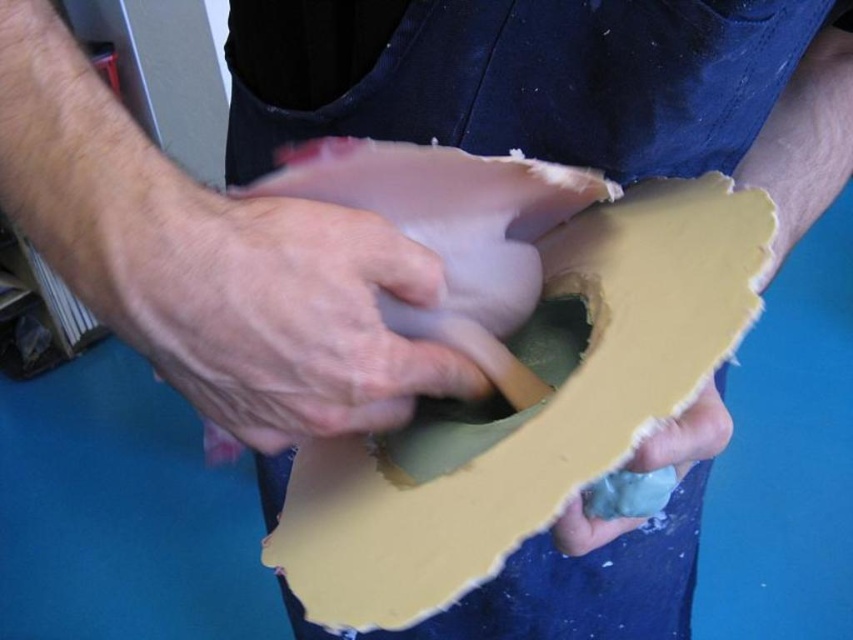
Question: Which is farther from the matte yellow cardboard at center?

Choices:
 (A) dry matte skin at center
 (B) matte yellow foam at lower center

Answer: (B)

Question: Does dry matte skin at center appear under matte yellow foam at lower center?

Choices:
 (A) no
 (B) yes

Answer: (A)

Question: Does dry matte skin at center appear over matte yellow foam at lower center?

Choices:
 (A) no
 (B) yes

Answer: (B)

Question: Which of these objects is positioned closest to the matte yellow cardboard at center?

Choices:
 (A) dry matte skin at center
 (B) matte yellow foam at lower center

Answer: (A)

Question: Is dry matte skin at center wider than matte yellow foam at lower center?

Choices:
 (A) no
 (B) yes

Answer: (B)

Question: Which point is farther from the camera taking this photo?

Choices:
 (A) (584, 243)
 (B) (700, 448)

Answer: (A)